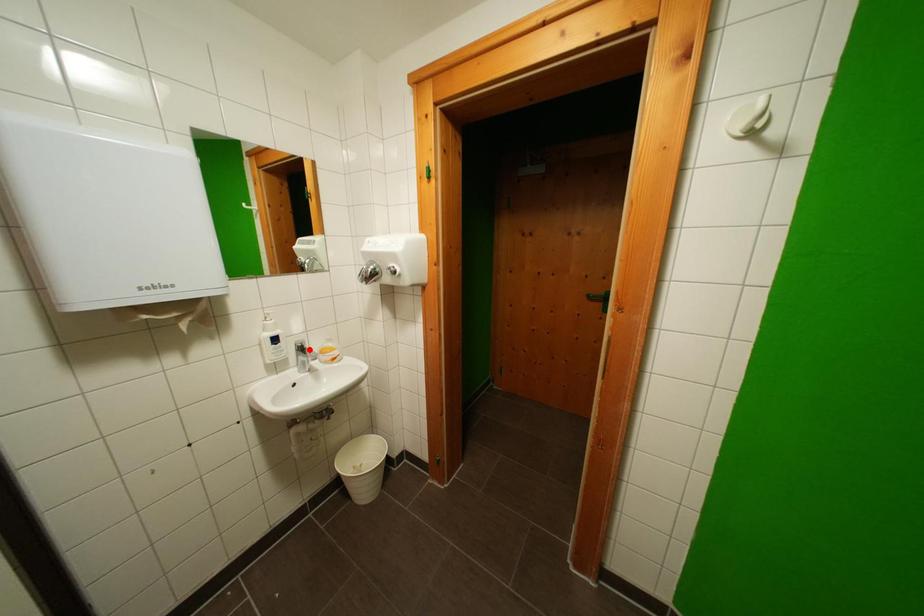
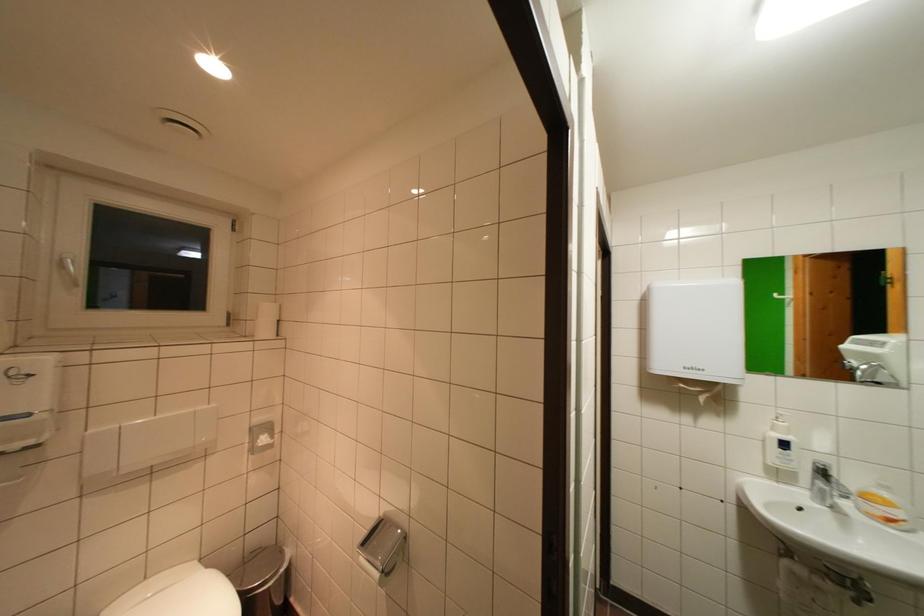
Question: I am providing you with two images of the same scene from different viewpoints. In image1, a red point is highlighted. Considering the same 3D point in image2, which of the following is correct?

Choices:
 (A) It is closer
 (B) It is farther

Answer: (A)